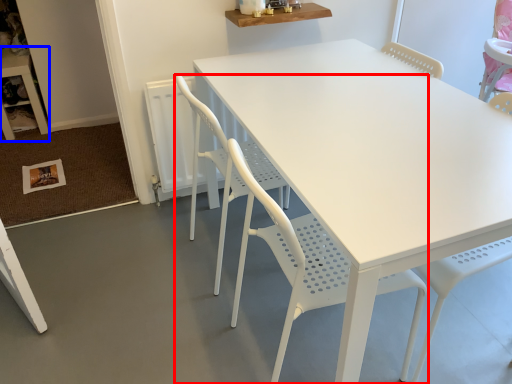
Question: Which object appears farthest to the camera in this image, chair (highlighted by a red box) or table (highlighted by a blue box)?

Choices:
 (A) chair
 (B) table

Answer: (B)